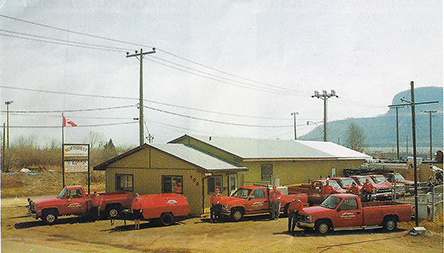
Locate an element on the screen. The width and height of the screenshot is (444, 253). windows is located at coordinates (260, 170), (173, 181), (125, 178).